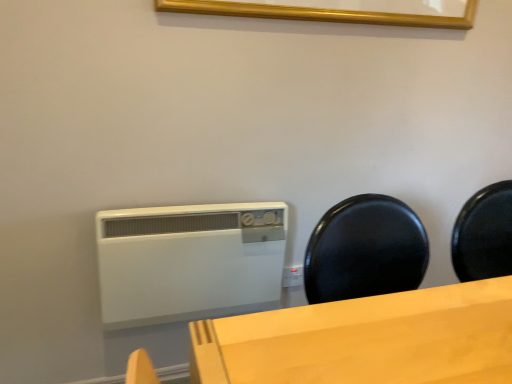
Question: Considering the relative sizes of white plastic heater at center and gold wooden picture frame at upper center in the image provided, is white plastic heater at center wider than gold wooden picture frame at upper center?

Choices:
 (A) yes
 (B) no

Answer: (A)

Question: Is white plastic heater at center in front of gold wooden picture frame at upper center?

Choices:
 (A) no
 (B) yes

Answer: (A)

Question: Is gold wooden picture frame at upper center surrounded by white plastic heater at center?

Choices:
 (A) yes
 (B) no

Answer: (B)

Question: Is white plastic heater at center oriented away from gold wooden picture frame at upper center?

Choices:
 (A) no
 (B) yes

Answer: (A)

Question: From a real-world perspective, does white plastic heater at center stand above gold wooden picture frame at upper center?

Choices:
 (A) no
 (B) yes

Answer: (A)

Question: Can you confirm if white plastic heater at center is bigger than gold wooden picture frame at upper center?

Choices:
 (A) yes
 (B) no

Answer: (A)

Question: Does gold wooden picture frame at upper center have a lesser height compared to white plastic heater at center?

Choices:
 (A) yes
 (B) no

Answer: (A)

Question: Is gold wooden picture frame at upper center closer to camera compared to white plastic heater at center?

Choices:
 (A) yes
 (B) no

Answer: (A)

Question: From the image's perspective, is gold wooden picture frame at upper center on top of white plastic heater at center?

Choices:
 (A) yes
 (B) no

Answer: (A)

Question: Does gold wooden picture frame at upper center turn towards white plastic heater at center?

Choices:
 (A) yes
 (B) no

Answer: (B)

Question: Would you say gold wooden picture frame at upper center is outside white plastic heater at center?

Choices:
 (A) no
 (B) yes

Answer: (B)

Question: Is gold wooden picture frame at upper center taller than white plastic heater at center?

Choices:
 (A) no
 (B) yes

Answer: (A)

Question: In terms of size, does white plastic heater at center appear bigger or smaller than gold wooden picture frame at upper center?

Choices:
 (A) big
 (B) small

Answer: (A)